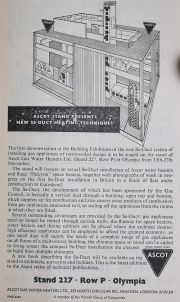
Locate an element on the screen. Image resolution: width=180 pixels, height=302 pixels. stand is located at coordinates (44, 272).